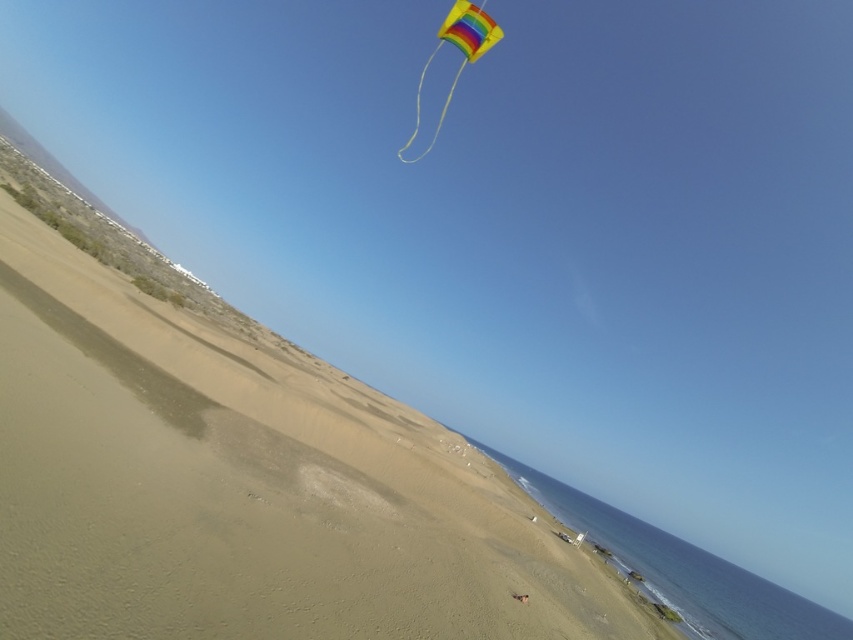
Looking at this image, you are an artist planning to paint this beach scene. You want to ensure the smooth sand at center and the rainbow fabric kite at upper center are both visible. Which object should you make larger in your painting?

The rainbow fabric kite at upper center should be made larger because it occupies more space than the smooth sand at center in the scene.